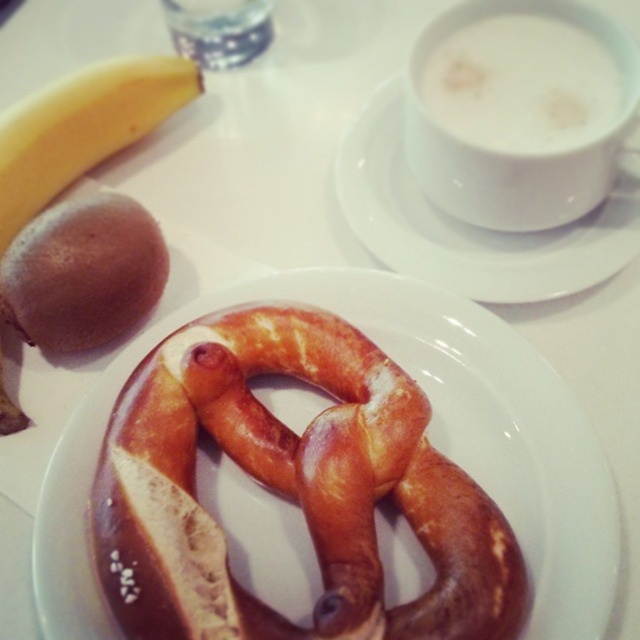
Can you confirm if white matte cup at upper center is bigger than white frothy coffee at upper right?

Yes, white matte cup at upper center is bigger than white frothy coffee at upper right.

Which is behind, point (588, 278) or point (419, 83)?

The point (419, 83) is more distant.

What are the coordinates of `white matte cup at upper center` in the screenshot? It's located at (472, 225).

Is white frothy coffee at upper right shorter than translucent plastic bottle at upper center?

Incorrect, white frothy coffee at upper right's height does not fall short of translucent plastic bottle at upper center's.

Which is above, white frothy coffee at upper right or translucent plastic bottle at upper center?

Positioned higher is translucent plastic bottle at upper center.

At what (x,y) coordinates should I click in order to perform the action: click on white frothy coffee at upper right. Please return your answer as a coordinate pair (x, y). The image size is (640, 640). Looking at the image, I should click on (522, 84).

I want to click on white frothy coffee at upper right, so click(522, 84).

Based on the photo, which of these two, white matte cup at upper center or translucent plastic bottle at upper center, stands taller?

white matte cup at upper center

Between point (384, 180) and point (240, 4), which one is positioned in front?

Point (384, 180) is more forward.

Where is `white matte cup at upper center`? This screenshot has width=640, height=640. white matte cup at upper center is located at coordinates (x=472, y=225).